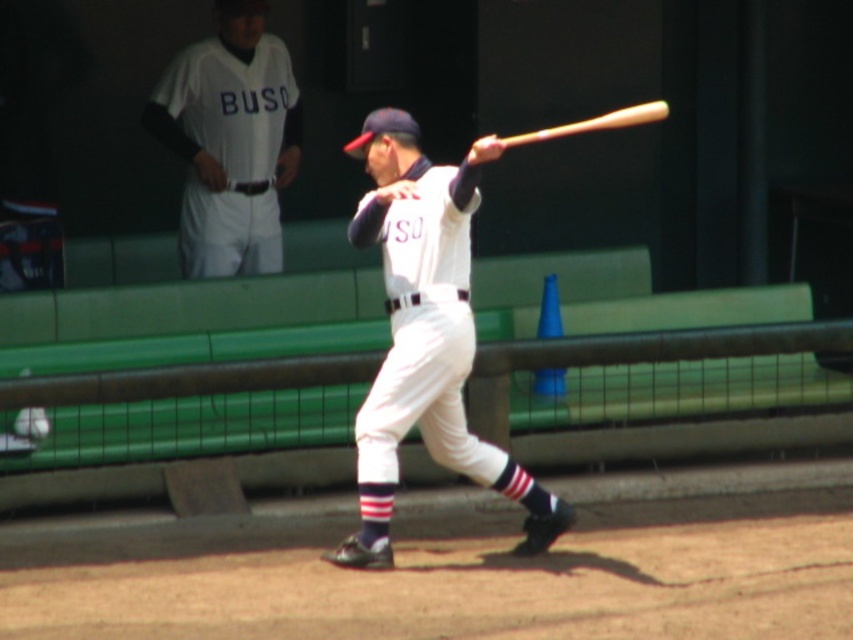
You are a baseball coach analyzing the swing of the batter. You notice two bats at the center of the image. Which bat is closer to the batter, the white matte baseball bat at center or the wooden baseball bat at center?

The white matte baseball bat at center is closer to the batter because the wooden baseball bat at center is positioned behind it.